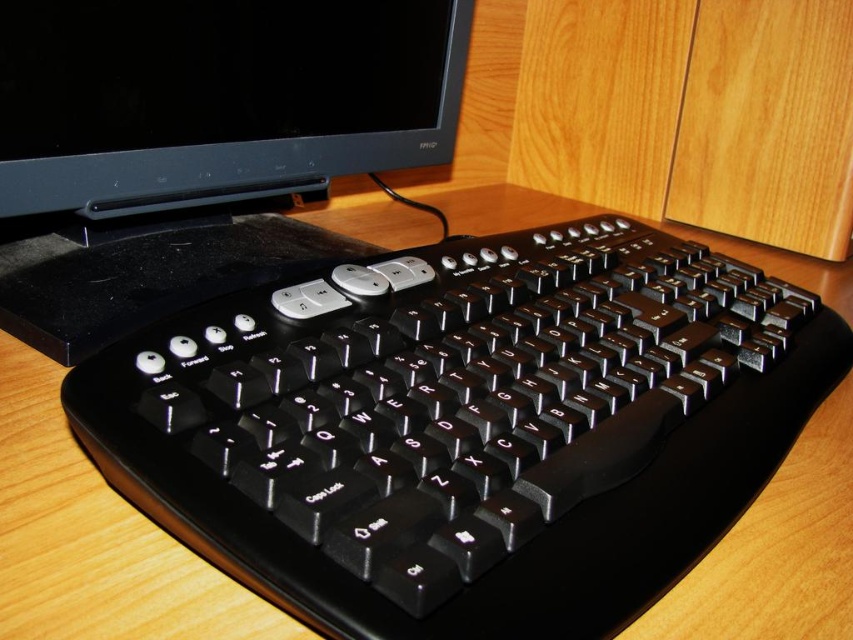
You are setting up a new desk arrangement and want to ensure there is enough space between the black plastic monitor at upper center and the wooden computer desk at center. Considering their thickness, which one requires more horizontal space?

The wooden computer desk at center requires more horizontal space because it is thicker than the black plastic monitor at upper center.

You are setting up a new workspace and want to ensure proper ergonomics. Given the black plastic monitor at upper center and the wooden computer desk at center, which object should be positioned higher to promote good posture?

The black plastic monitor at upper center should be positioned higher than the wooden computer desk at center to promote good posture, as it is already located above the desk according to the description.

You are setting up a new monitor and want to place it to the right of the wooden computer desk at center. Is the current position of the black plastic monitor at upper center blocking that spot?

The black plastic monitor at upper center is currently positioned to the left of the wooden computer desk at center, so the spot to the right of the wooden computer desk at center is not blocked by it.